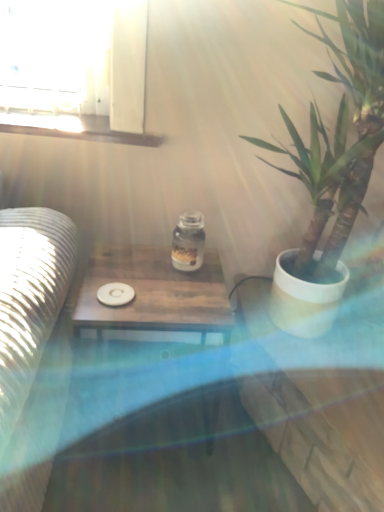
Question: Does white matte coaster at center appear on the right side of wooden table at center?

Choices:
 (A) no
 (B) yes

Answer: (A)

Question: Is white matte coaster at center shorter than wooden table at center?

Choices:
 (A) no
 (B) yes

Answer: (B)

Question: Is wooden table at center at the back of white matte coaster at center?

Choices:
 (A) yes
 (B) no

Answer: (A)

Question: Is the surface of white matte coaster at center in direct contact with wooden table at center?

Choices:
 (A) yes
 (B) no

Answer: (B)

Question: Can you confirm if white matte coaster at center is bigger than wooden table at center?

Choices:
 (A) no
 (B) yes

Answer: (A)

Question: Is transparent glass jar at center bigger or smaller than green leafy plant in white pot at right?

Choices:
 (A) small
 (B) big

Answer: (A)

Question: In the image, is transparent glass jar at center on the left side or the right side of green leafy plant in white pot at right?

Choices:
 (A) left
 (B) right

Answer: (A)

Question: In terms of width, does transparent glass jar at center look wider or thinner when compared to green leafy plant in white pot at right?

Choices:
 (A) thin
 (B) wide

Answer: (A)

Question: Considering the positions of transparent glass jar at center and green leafy plant in white pot at right in the image, is transparent glass jar at center taller or shorter than green leafy plant in white pot at right?

Choices:
 (A) tall
 (B) short

Answer: (B)

Question: In the image, is wooden table at center on the left side or the right side of transparent glass jar at center?

Choices:
 (A) right
 (B) left

Answer: (B)

Question: From a real-world perspective, is wooden table at center above or below transparent glass jar at center?

Choices:
 (A) below
 (B) above

Answer: (A)

Question: From the image's perspective, relative to transparent glass jar at center, is wooden table at center above or below?

Choices:
 (A) below
 (B) above

Answer: (A)

Question: Looking at their shapes, would you say wooden table at center is wider or thinner than transparent glass jar at center?

Choices:
 (A) thin
 (B) wide

Answer: (B)

Question: Considering their positions, is transparent glass jar at center located in front of or behind wooden table at center?

Choices:
 (A) front
 (B) behind

Answer: (B)

Question: Considering the positions of transparent glass jar at center and wooden table at center in the image, is transparent glass jar at center taller or shorter than wooden table at center?

Choices:
 (A) short
 (B) tall

Answer: (A)